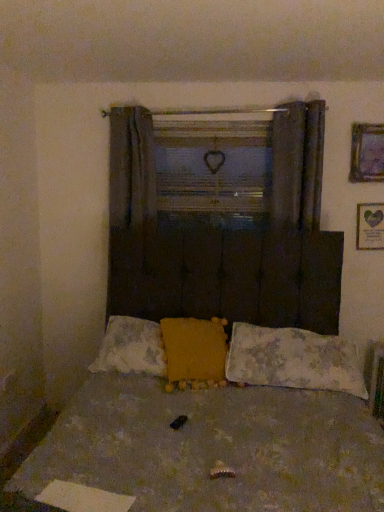
The width and height of the screenshot is (384, 512). Describe the element at coordinates (298, 163) in the screenshot. I see `dark gray fabric curtain at upper center` at that location.

You are a GUI agent. You are given a task and a screenshot of the screen. Output one action in this format:
    pyautogui.click(x=<x>, y=<y>)
    Task: Click on the fluffy white pillow at center, which ranks as the 3th pillow in left-to-right order
    The image size is (384, 512).
    Given the screenshot: What is the action you would take?
    pyautogui.click(x=293, y=360)

Measure the distance between fluffy yellow pillow at center, arranged as the third pillow when viewed from the right, and camera.

The depth of fluffy yellow pillow at center, arranged as the third pillow when viewed from the right, is 7.07 feet.

Find the location of a particular element. yellow fabric pillow at center, marked as the second pillow in a left-to-right arrangement is located at coordinates (194, 348).

Describe the element at coordinates (377, 381) in the screenshot. I see `white plastic radiator at lower right` at that location.

Find the location of `wooden frame at center`. wooden frame at center is located at coordinates (212, 164).

The height and width of the screenshot is (512, 384). Describe the element at coordinates (212, 164) in the screenshot. I see `wooden frame at center` at that location.

Find the location of `dark gray fabric curtain at upper center`. dark gray fabric curtain at upper center is located at coordinates (298, 163).

Based on the photo, can we say dark gray fabric curtain at upper center lies outside fluffy yellow pillow at center, placed as the 1th pillow when sorted from left to right?

dark gray fabric curtain at upper center is positioned outside fluffy yellow pillow at center, placed as the 1th pillow when sorted from left to right.

Is dark gray fabric curtain at upper center positioned in front of fluffy yellow pillow at center, placed as the 1th pillow when sorted from left to right?

No, the depth of dark gray fabric curtain at upper center is greater than that of fluffy yellow pillow at center, placed as the 1th pillow when sorted from left to right.

In terms of width, does dark gray fabric curtain at upper center look wider or thinner when compared to fluffy yellow pillow at center, arranged as the third pillow when viewed from the right?

Considering their sizes, dark gray fabric curtain at upper center looks slimmer than fluffy yellow pillow at center, arranged as the third pillow when viewed from the right.

In the scene shown: Can you tell me how much dark gray fabric curtain at upper center and fluffy yellow pillow at center, placed as the 1th pillow when sorted from left to right, differ in facing direction?

They differ by 3.71 degrees in their facing directions.

Which is more to the right, purple glass picture frame at upper right, the 2th picture frame in the bottom-to-top sequence, or fluffy white pillow at center, which is the first pillow in right-to-left order?

Positioned to the right is purple glass picture frame at upper right, the 2th picture frame in the bottom-to-top sequence.

From a real-world perspective, between purple glass picture frame at upper right, the first picture frame positioned from the top, and fluffy white pillow at center, which is the first pillow in right-to-left order, who is vertically higher?

purple glass picture frame at upper right, the first picture frame positioned from the top, from a real-world perspective.

From the image's perspective, is purple glass picture frame at upper right, the first picture frame positioned from the top, on top of fluffy white pillow at center, which is the first pillow in right-to-left order?

Yes, from the image's perspective, purple glass picture frame at upper right, the first picture frame positioned from the top, is over fluffy white pillow at center, which is the first pillow in right-to-left order.

What's the angular difference between purple glass picture frame at upper right, the first picture frame positioned from the top, and fluffy white pillow at center, which ranks as the 3th pillow in left-to-right order,'s facing directions?

purple glass picture frame at upper right, the first picture frame positioned from the top, and fluffy white pillow at center, which ranks as the 3th pillow in left-to-right order, are facing 1.85 degrees away from each other.

Which object is closer to the camera taking this photo, green paper picture frame at upper right, which is counted as the second picture frame, starting from the top, or wooden frame at center?

Positioned in front is green paper picture frame at upper right, which is counted as the second picture frame, starting from the top.

From a real-world perspective, which is physically below, green paper picture frame at upper right, which is counted as the second picture frame, starting from the top, or wooden frame at center?

green paper picture frame at upper right, which is counted as the second picture frame, starting from the top, is physically lower.

Is green paper picture frame at upper right, the 1th picture frame ordered from the bottom, oriented towards wooden frame at center?

No, green paper picture frame at upper right, the 1th picture frame ordered from the bottom, is not facing towards wooden frame at center.

Considering the sizes of objects green paper picture frame at upper right, which is counted as the second picture frame, starting from the top, and wooden frame at center in the image provided, who is shorter, green paper picture frame at upper right, which is counted as the second picture frame, starting from the top, or wooden frame at center?

green paper picture frame at upper right, which is counted as the second picture frame, starting from the top.

How distant is green paper picture frame at upper right, which is counted as the second picture frame, starting from the top, from purple glass picture frame at upper right, the first picture frame positioned from the top?

The distance of green paper picture frame at upper right, which is counted as the second picture frame, starting from the top, from purple glass picture frame at upper right, the first picture frame positioned from the top, is 32.50 centimeters.

This screenshot has width=384, height=512. I want to click on picture frame behind the purple glass picture frame at upper right, the 2th picture frame in the bottom-to-top sequence, so click(370, 226).

From a real-world perspective, is green paper picture frame at upper right, which is counted as the second picture frame, starting from the top, above or below purple glass picture frame at upper right, the 2th picture frame in the bottom-to-top sequence?

green paper picture frame at upper right, which is counted as the second picture frame, starting from the top, is situated lower than purple glass picture frame at upper right, the 2th picture frame in the bottom-to-top sequence, in the real world.

From the image's perspective, is green paper picture frame at upper right, which is counted as the second picture frame, starting from the top, on top of purple glass picture frame at upper right, the 2th picture frame in the bottom-to-top sequence?

No.

Is green paper picture frame at upper right, which is counted as the second picture frame, starting from the top, positioned behind dark gray fabric curtain at upper center?

Yes, it is.

Identify the location of curtain in front of the green paper picture frame at upper right, the 1th picture frame ordered from the bottom. The image size is (384, 512). (298, 163).

How many degrees apart are the facing directions of green paper picture frame at upper right, the 1th picture frame ordered from the bottom, and dark gray fabric curtain at upper center?

2.02 degrees separate the facing orientations of green paper picture frame at upper right, the 1th picture frame ordered from the bottom, and dark gray fabric curtain at upper center.

Does point (378, 217) come in front of point (292, 148)?

No, it is not.

Which is behind, point (331, 378) or point (155, 148)?

The point (155, 148) is farther.

From the picture: Measure the distance from fluffy white pillow at center, which ranks as the 3th pillow in left-to-right order, to wooden frame at center.

fluffy white pillow at center, which ranks as the 3th pillow in left-to-right order, is 3.86 feet from wooden frame at center.

This screenshot has height=512, width=384. Find the location of `pillow on the right of wooden frame at center`. pillow on the right of wooden frame at center is located at coordinates (293, 360).

Is fluffy white pillow at center, which ranks as the 3th pillow in left-to-right order, positioned before wooden frame at center?

Yes, fluffy white pillow at center, which ranks as the 3th pillow in left-to-right order, is closer to the camera.

Looking at the image, does yellow fabric pillow at center, marked as the second pillow in a left-to-right arrangement, seem bigger or smaller compared to purple glass picture frame at upper right, the 2th picture frame in the bottom-to-top sequence?

Considering their sizes, yellow fabric pillow at center, marked as the second pillow in a left-to-right arrangement, takes up more space than purple glass picture frame at upper right, the 2th picture frame in the bottom-to-top sequence.

Considering the points (204, 341) and (356, 166), which point is in front, point (204, 341) or point (356, 166)?

The point (204, 341) is closer to the camera.

Looking at this image, is yellow fabric pillow at center, which appears as the second pillow when viewed from the right, with purple glass picture frame at upper right, the 2th picture frame in the bottom-to-top sequence?

No, yellow fabric pillow at center, which appears as the second pillow when viewed from the right, is not with purple glass picture frame at upper right, the 2th picture frame in the bottom-to-top sequence.

Which is more to the left, yellow fabric pillow at center, which appears as the second pillow when viewed from the right, or purple glass picture frame at upper right, the first picture frame positioned from the top?

yellow fabric pillow at center, which appears as the second pillow when viewed from the right, is more to the left.

From the dark gray fabric curtain at upper center, count 1st pillows forward and point to it. Please provide its 2D coordinates.

[(131, 348)]

Which picture frame is the 1st one when counting from the right side of the fluffy white pillow at center, which is the first pillow in right-to-left order? Please provide its 2D coordinates.

[(367, 153)]

Considering their positions, is fluffy white pillow at center, which is the first pillow in right-to-left order, positioned closer to purple glass picture frame at upper right, the 2th picture frame in the bottom-to-top sequence, than dark gray fabric curtain at upper center?

dark gray fabric curtain at upper center.

Considering their positions, is dark gray fabric curtain at upper center positioned closer to wooden frame at center than green paper picture frame at upper right, the 1th picture frame ordered from the bottom?

dark gray fabric curtain at upper center.

Looking at this image, from the image, which object appears to be nearer to fluffy yellow pillow at center, placed as the 1th pillow when sorted from left to right, purple glass picture frame at upper right, the first picture frame positioned from the top, or white plastic radiator at lower right?

Based on the image, white plastic radiator at lower right appears to be nearer to fluffy yellow pillow at center, placed as the 1th pillow when sorted from left to right.

Based on the photo, looking at the image, which one is located closer to white plastic radiator at lower right, purple glass picture frame at upper right, the 2th picture frame in the bottom-to-top sequence, or fluffy white pillow at center, which is the first pillow in right-to-left order?

Among the two, fluffy white pillow at center, which is the first pillow in right-to-left order, is located nearer to white plastic radiator at lower right.

From the image, which object appears to be nearer to dark gray fabric curtain at upper center, purple glass picture frame at upper right, the 2th picture frame in the bottom-to-top sequence, or fluffy fabric bed at center?

Based on the image, purple glass picture frame at upper right, the 2th picture frame in the bottom-to-top sequence, appears to be nearer to dark gray fabric curtain at upper center.

Based on their spatial positions, is dark gray fabric curtain at upper center or wooden frame at center further from yellow fabric pillow at center, marked as the second pillow in a left-to-right arrangement?

Based on the image, wooden frame at center appears to be further to yellow fabric pillow at center, marked as the second pillow in a left-to-right arrangement.

Based on their spatial positions, is yellow fabric pillow at center, which appears as the second pillow when viewed from the right, or fluffy fabric bed at center further from green paper picture frame at upper right, which is counted as the second picture frame, starting from the top?

Based on the image, fluffy fabric bed at center appears to be further to green paper picture frame at upper right, which is counted as the second picture frame, starting from the top.

From the image, which object appears to be nearer to dark gray fabric curtain at upper center, yellow fabric pillow at center, marked as the second pillow in a left-to-right arrangement, or fluffy white pillow at center, which ranks as the 3th pillow in left-to-right order?

→ Based on the image, fluffy white pillow at center, which ranks as the 3th pillow in left-to-right order, appears to be nearer to dark gray fabric curtain at upper center.

At what (x,y) coordinates should I click in order to perform the action: click on curtain between fluffy fabric bed at center and white plastic radiator at lower right in the front-back direction. Please return your answer as a coordinate pair (x, y). This screenshot has width=384, height=512. Looking at the image, I should click on (298, 163).

At what (x,y) coordinates should I click in order to perform the action: click on curtain located between wooden frame at center and purple glass picture frame at upper right, the 2th picture frame in the bottom-to-top sequence, in the left-right direction. Please return your answer as a coordinate pair (x, y). Looking at the image, I should click on point(298,163).

Where is `window frame between dark gray fabric curtain at upper center and white plastic radiator at lower right vertically`? The width and height of the screenshot is (384, 512). window frame between dark gray fabric curtain at upper center and white plastic radiator at lower right vertically is located at coordinates (212, 164).

Find the location of a particular element. The image size is (384, 512). window frame between purple glass picture frame at upper right, the 2th picture frame in the bottom-to-top sequence, and fluffy white pillow at center, which is the first pillow in right-to-left order, in the up-down direction is located at coordinates (212, 164).